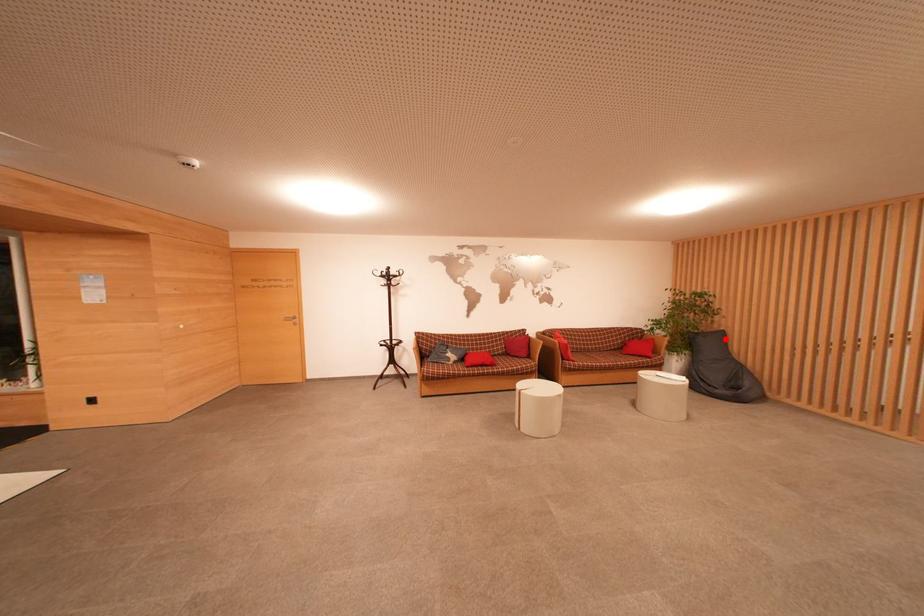
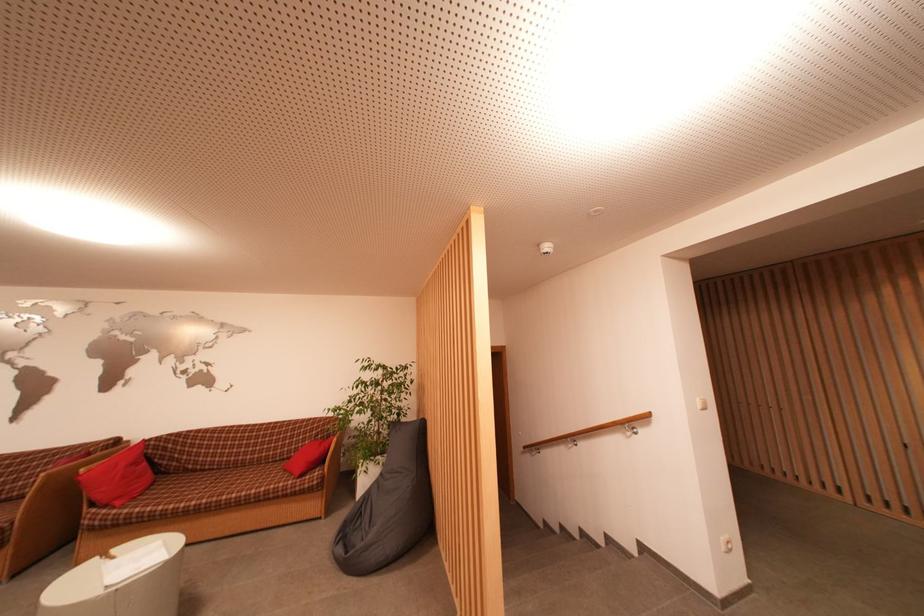
In the second image, find the point that corresponds to the highlighted location in the first image.

(426, 430)